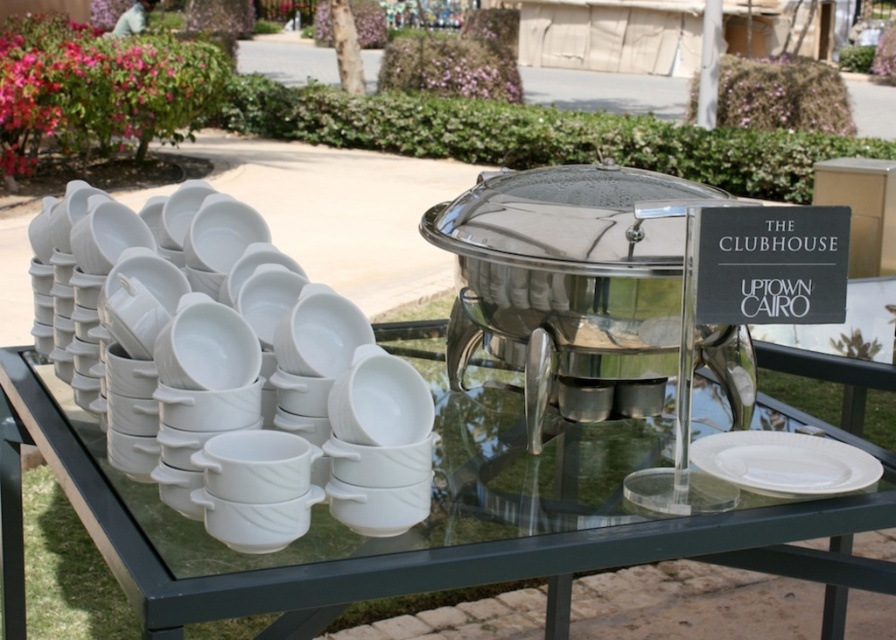
You are at a buffet and want to place a small salad on the white glossy plate at left. Considering the size of the plate and the table, will the plate fit comfortably on the transparent glass table at center without overhanging the edges?

The white glossy plate at left is smaller than the transparent glass table at center, so it will fit comfortably without overhanging the edges.

You are at a buffet and want to grab a plate. You see the transparent glass table at center and the white matte plate at center. Which one should you approach first to reach the plate?

You should approach the transparent glass table at center first because the white matte plate at center is behind it, making the table closer to you.